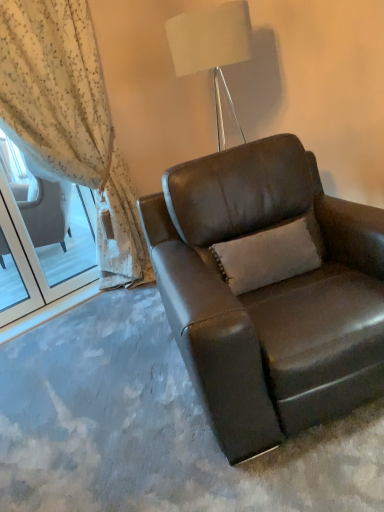
Question: In terms of size, does white fabric lampshade at upper center appear bigger or smaller than sheer floral fabric at left?

Choices:
 (A) big
 (B) small

Answer: (B)

Question: Is point (228, 17) positioned closer to the camera than point (140, 257)?

Choices:
 (A) farther
 (B) closer

Answer: (B)

Question: Which is farther from the brown leather chair at center?

Choices:
 (A) beige fabric pillow at center
 (B) sheer floral fabric at left
 (C) white fabric lampshade at upper center

Answer: (B)

Question: Which of these objects is positioned farthest from the beige fabric pillow at center?

Choices:
 (A) sheer floral fabric at left
 (B) brown leather chair at center
 (C) white fabric lampshade at upper center

Answer: (A)